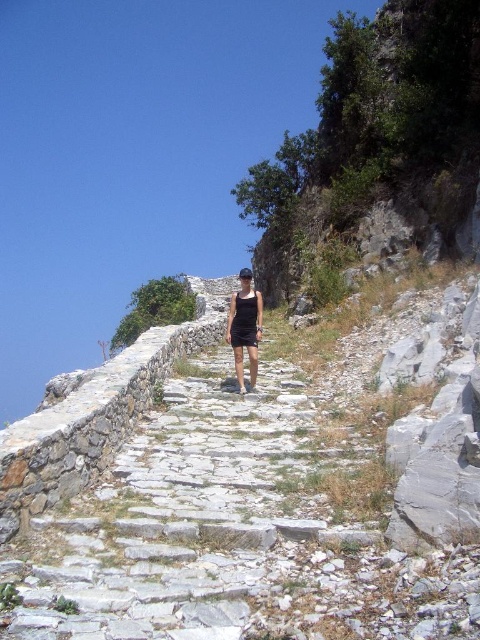
Who is higher up, green leafy hillside at upper right or black matte shorts at center?

green leafy hillside at upper right is above.

Does green leafy hillside at upper right have a greater height compared to black matte shorts at center?

Yes, green leafy hillside at upper right is taller than black matte shorts at center.

Does point (266, 294) come in front of point (250, 362)?

No, it is not.

Locate an element on the screen. The width and height of the screenshot is (480, 640). green leafy hillside at upper right is located at coordinates point(373,132).